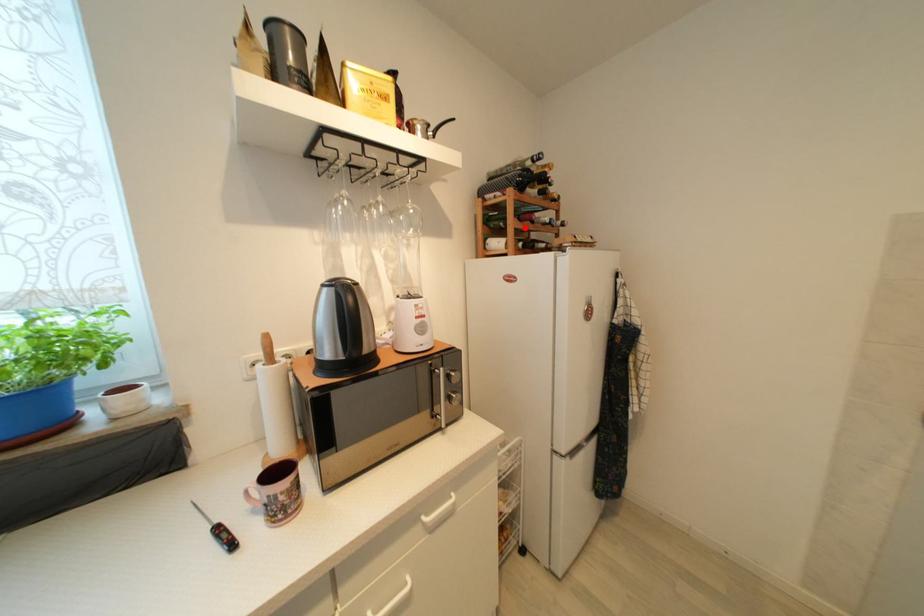
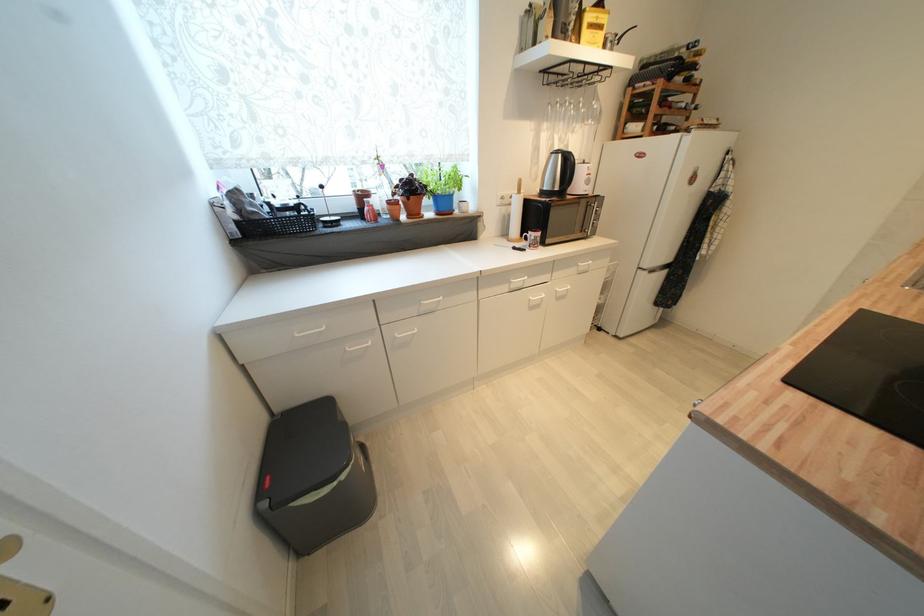
Locate, in the second image, the point that corresponds to the highlighted location in the first image.

(664, 114)